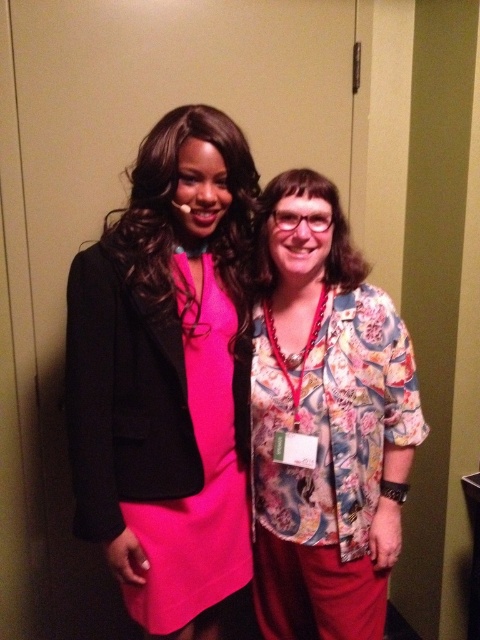
Question: Which point is closer to the camera taking this photo?

Choices:
 (A) (139, 508)
 (B) (160, 186)

Answer: (B)

Question: Can you confirm if matte pink dress at center is positioned above floral-patterned blouse at right?

Choices:
 (A) no
 (B) yes

Answer: (B)

Question: Is floral-patterned blouse at right to the right of matte pink fabric dress at center from the viewer's perspective?

Choices:
 (A) yes
 (B) no

Answer: (A)

Question: Does matte pink dress at center lie in front of floral-patterned blouse at right?

Choices:
 (A) yes
 (B) no

Answer: (A)

Question: Which of the following is the farthest from the observer?

Choices:
 (A) matte pink fabric dress at center
 (B) matte pink dress at center

Answer: (A)

Question: Which point appears farthest from the camera in this image?

Choices:
 (A) (264, 627)
 (B) (192, 573)
 (C) (117, 572)

Answer: (A)